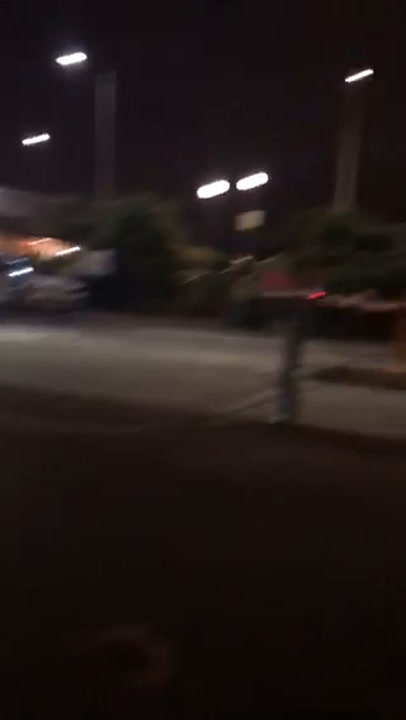
The width and height of the screenshot is (406, 720). What are the coordinates of `lights` in the screenshot? It's located at (33, 140), (73, 58), (218, 192), (255, 181), (361, 71).